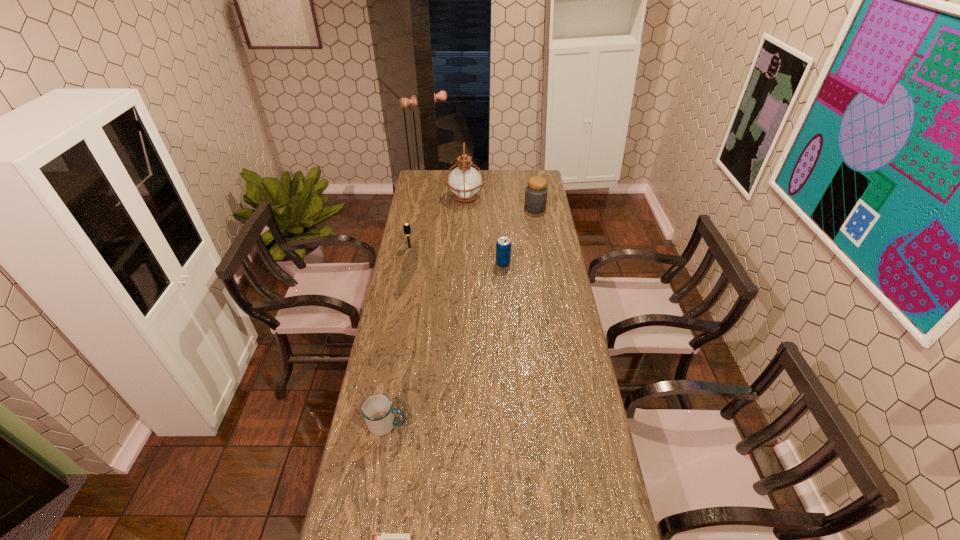
Identify the location of vacant space at the right edge of the desktop. The width and height of the screenshot is (960, 540). (542, 287).

The width and height of the screenshot is (960, 540). I want to click on vacant space at the far right corner of the desktop, so click(545, 176).

Locate an element on the screen. free point between the fifth shortest object and the mug is located at coordinates (461, 316).

Where is `unoccupied position between the second nearest object and the jar`? unoccupied position between the second nearest object and the jar is located at coordinates (461, 316).

Identify the location of free space between the hairbrush and the second shortest object. The width and height of the screenshot is (960, 540). (398, 336).

Locate an element on the screen. Image resolution: width=960 pixels, height=540 pixels. free space between the second tallest object and the fifth farthest object is located at coordinates (461, 316).

This screenshot has height=540, width=960. Identify the location of unoccupied position between the pop soda and the fourth nearest object. (456, 255).

The width and height of the screenshot is (960, 540). Find the location of `vacant space that's between the tallest object and the jar`. vacant space that's between the tallest object and the jar is located at coordinates (500, 203).

Find the location of a particular element. This screenshot has width=960, height=540. unoccupied position between the second tallest object and the hairbrush is located at coordinates (472, 228).

You are a GUI agent. You are given a task and a screenshot of the screen. Output one action in this format:
    pyautogui.click(x=<x>, y=<y>)
    Task: Click on the unoccupied position between the fourth farthest object and the hairbrush
    The height and width of the screenshot is (540, 960).
    Given the screenshot: What is the action you would take?
    pyautogui.click(x=456, y=255)